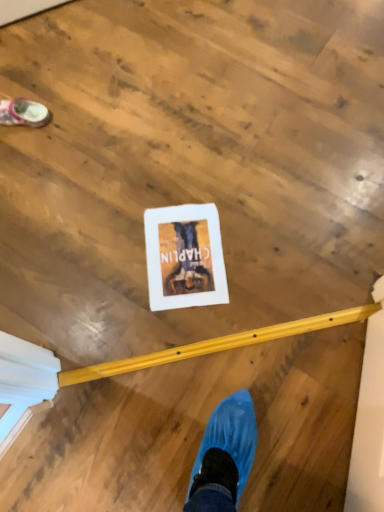
Find the location of a particular element. vacant location below white paper at center (from a real-world perspective) is located at coordinates (185, 256).